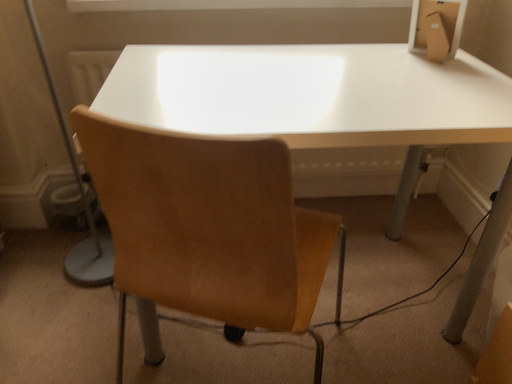
Locate an element on the screen. This screenshot has height=384, width=512. vacant space underneath matte gray table lamp at left (from a real-world perspective) is located at coordinates (76, 313).